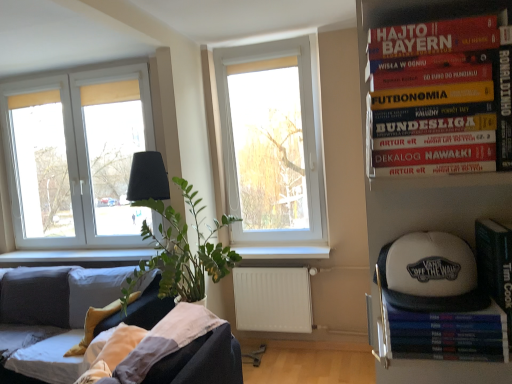
Image resolution: width=512 pixels, height=384 pixels. I want to click on white wood window sill at center, so click(283, 252).

The width and height of the screenshot is (512, 384). I want to click on hardcover book at upper right, so click(432, 98).

What do you see at coordinates (430, 274) in the screenshot? I see `white fabric baseball cap at right` at bounding box center [430, 274].

In order to click on white plastic window at center, which ranks as the 1th window in right-to-left order in this screenshot , I will do `click(273, 142)`.

How much space does green matte paperback book at right, the 1th paperback book positioned from the right, occupy horizontally?

6.66 inches.

Find the location of a particular element. white wood window sill at center is located at coordinates coord(283,252).

Does point (486, 360) appear closer or farther from the camera than point (306, 284)?

Clearly, point (486, 360) is closer to the camera than point (306, 284).

Between white matte baseball cap at right, which is counted as the first paperback book, starting from the left, and white matte radiator at lower center, which one has smaller width?

white matte baseball cap at right, which is counted as the first paperback book, starting from the left, is thinner.

Is the surface of white matte baseball cap at right, the 2th paperback book from the right, in direct contact with white matte radiator at lower center?

white matte baseball cap at right, the 2th paperback book from the right, and white matte radiator at lower center are not in contact.

How much distance is there between white matte baseball cap at right, which is counted as the first paperback book, starting from the left, and white matte radiator at lower center?

white matte baseball cap at right, which is counted as the first paperback book, starting from the left, and white matte radiator at lower center are 8.53 feet apart from each other.

Is white plastic window at left, the 2th window in the front-to-back sequence, wider or thinner than white plastic window at center, the 1th window from the front?

white plastic window at left, the 2th window in the front-to-back sequence, is thinner than white plastic window at center, the 1th window from the front.

Is white plastic window at left, which is counted as the first window, starting from the back, at the left side of white plastic window at center, which ranks as the 1th window in right-to-left order?

Yes.

Is white plastic window at left, which is counted as the second window, starting from the right, located outside white plastic window at center, which ranks as the 1th window in right-to-left order?

white plastic window at left, which is counted as the second window, starting from the right, lies outside white plastic window at center, which ranks as the 1th window in right-to-left order,'s area.

Considering the positions of points (144, 143) and (262, 226), is point (144, 143) closer to camera compared to point (262, 226)?

Yes, point (144, 143) is closer to viewer.

In the scene shown: From a real-world perspective, is white plastic window at center, which is the 2th window in left-to-right order, positioned under white matte baseball cap at right, which is counted as the first paperback book, starting from the left, based on gravity?

No, from a real-world perspective, white plastic window at center, which is the 2th window in left-to-right order, is not under white matte baseball cap at right, which is counted as the first paperback book, starting from the left.

Does white plastic window at center, the 1th window from the front, lie behind white matte baseball cap at right, which is counted as the first paperback book, starting from the left?

Yes, white plastic window at center, the 1th window from the front, is further from the viewer.

From the image's perspective, relative to white matte baseball cap at right, the 2th paperback book from the right, is white plastic window at center, the 1th window from the front, above or below?

Based on their image positions, white plastic window at center, the 1th window from the front, is located above white matte baseball cap at right, the 2th paperback book from the right.

Considering the relative positions of hardcover book at upper right and white plastic window at center, which is counted as the second window, starting from the back, in the image provided, is hardcover book at upper right behind white plastic window at center, which is counted as the second window, starting from the back,?

No.

From the image's perspective, does hardcover book at upper right appear higher than white plastic window at center, which is the 2th window in left-to-right order?

No, from the image's perspective, hardcover book at upper right is not on top of white plastic window at center, which is the 2th window in left-to-right order.

Is hardcover book at upper right next to white plastic window at center, which is counted as the second window, starting from the back, and touching it?

No, hardcover book at upper right is not in contact with white plastic window at center, which is counted as the second window, starting from the back.

Is hardcover book at upper right located outside white plastic window at center, which ranks as the 1th window in right-to-left order?

That's correct, hardcover book at upper right is outside of white plastic window at center, which ranks as the 1th window in right-to-left order.

Which object is wider, green matte paperback book at right, the 1th paperback book positioned from the right, or white plastic window at left, which is counted as the first window, starting from the back?

With larger width is green matte paperback book at right, the 1th paperback book positioned from the right.

Is white plastic window at left, the 2th window in the front-to-back sequence, at the back of green matte paperback book at right, acting as the second paperback book starting from the left?

No.

Is green matte paperback book at right, the 1th paperback book positioned from the right, next to white plastic window at left, which is counted as the first window, starting from the back?

They are not placed beside each other.

Which window is the 2nd one when counting from the back of the green matte paperback book at right, the 1th paperback book positioned from the right? Please provide its 2D coordinates.

[(73, 151)]

Is white matte radiator at lower center wider than green matte paperback book at right, acting as the second paperback book starting from the left?

Indeed, white matte radiator at lower center has a greater width compared to green matte paperback book at right, acting as the second paperback book starting from the left.

Who is taller, white matte radiator at lower center or green matte paperback book at right, the 1th paperback book positioned from the right?

With more height is white matte radiator at lower center.

Which object is closer to the camera, white matte radiator at lower center or green matte paperback book at right, the 1th paperback book positioned from the right?

Positioned in front is green matte paperback book at right, the 1th paperback book positioned from the right.

From a real-world perspective, who is located lower, white matte baseball cap at right, the 2th paperback book from the right, or white wood window sill at center?

white wood window sill at center is physically lower.

Considering the sizes of white matte baseball cap at right, which is counted as the first paperback book, starting from the left, and white wood window sill at center in the image, is white matte baseball cap at right, which is counted as the first paperback book, starting from the left, wider or thinner than white wood window sill at center?

In the image, white matte baseball cap at right, which is counted as the first paperback book, starting from the left, appears to be more narrow than white wood window sill at center.

Could you tell me if white matte baseball cap at right, the 2th paperback book from the right, is turned towards white wood window sill at center?

No, white matte baseball cap at right, the 2th paperback book from the right, is not oriented towards white wood window sill at center.

Identify the location of radiator to the left of white matte baseball cap at right, which is counted as the first paperback book, starting from the left. Image resolution: width=512 pixels, height=384 pixels. (272, 299).

I want to click on window below the white plastic window at left, the 2th window in the front-to-back sequence (from a real-world perspective), so click(x=273, y=142).

From the image, which object appears to be farther from white plastic window at left, which is counted as the second window, starting from the right, hardcover book at upper right or white fabric baseball cap at right?

The object further to white plastic window at left, which is counted as the second window, starting from the right, is white fabric baseball cap at right.

Based on their spatial positions, is green matte paperback book at right, acting as the second paperback book starting from the left, or white plastic window at left, which is counted as the first window, starting from the back, closer to hardcover book at upper right?

Based on the image, green matte paperback book at right, acting as the second paperback book starting from the left, appears to be nearer to hardcover book at upper right.

When comparing their distances from green matte paperback book at right, the 1th paperback book positioned from the right, does white matte radiator at lower center or velvet dark grey couch at lower left seem further?

velvet dark grey couch at lower left lies further to green matte paperback book at right, the 1th paperback book positioned from the right, than the other object.

Based on their spatial positions, is white matte radiator at lower center or white matte baseball cap at right, which is counted as the first paperback book, starting from the left, further from white fabric baseball cap at right?

Among the two, white matte radiator at lower center is located further to white fabric baseball cap at right.

Based on their spatial positions, is green matte paperback book at right, the 1th paperback book positioned from the right, or white matte radiator at lower center closer to white plastic window at left, which is counted as the first window, starting from the back?

white matte radiator at lower center.

Which object lies nearer to the anchor point white plastic window at center, which ranks as the 1th window in right-to-left order, white wood window sill at center or white matte baseball cap at right, which is counted as the first paperback book, starting from the left?

The object closer to white plastic window at center, which ranks as the 1th window in right-to-left order, is white wood window sill at center.

When comparing their distances from white plastic window at center, which is the 2th window in left-to-right order, does white matte radiator at lower center or white fabric baseball cap at right seem further?

white fabric baseball cap at right lies further to white plastic window at center, which is the 2th window in left-to-right order, than the other object.

Which object lies further to the anchor point green matte paperback book at right, acting as the second paperback book starting from the left, white matte baseball cap at right, the 2th paperback book from the right, or white wood window sill at center?

The object further to green matte paperback book at right, acting as the second paperback book starting from the left, is white wood window sill at center.

Image resolution: width=512 pixels, height=384 pixels. In order to click on studio couch between green matte paperback book at right, acting as the second paperback book starting from the left, and white plastic window at left, which is counted as the second window, starting from the right, along the z-axis in this screenshot , I will do `click(50, 316)`.

You are a GUI agent. You are given a task and a screenshot of the screen. Output one action in this format:
    pyautogui.click(x=<x>, y=<y>)
    Task: Click on the studio couch positioned between white fabric baseball cap at right and white plastic window at center, which is counted as the second window, starting from the back, from near to far
    
    Given the screenshot: What is the action you would take?
    pyautogui.click(x=50, y=316)

Where is `window between hardcover book at upper right and white wood window sill at center in the front-back direction`? The height and width of the screenshot is (384, 512). window between hardcover book at upper right and white wood window sill at center in the front-back direction is located at coordinates (273, 142).

Locate an element on the screen. The image size is (512, 384). window located between green matte paperback book at right, acting as the second paperback book starting from the left, and white plastic window at left, which is counted as the first window, starting from the back, in the depth direction is located at coordinates (273, 142).